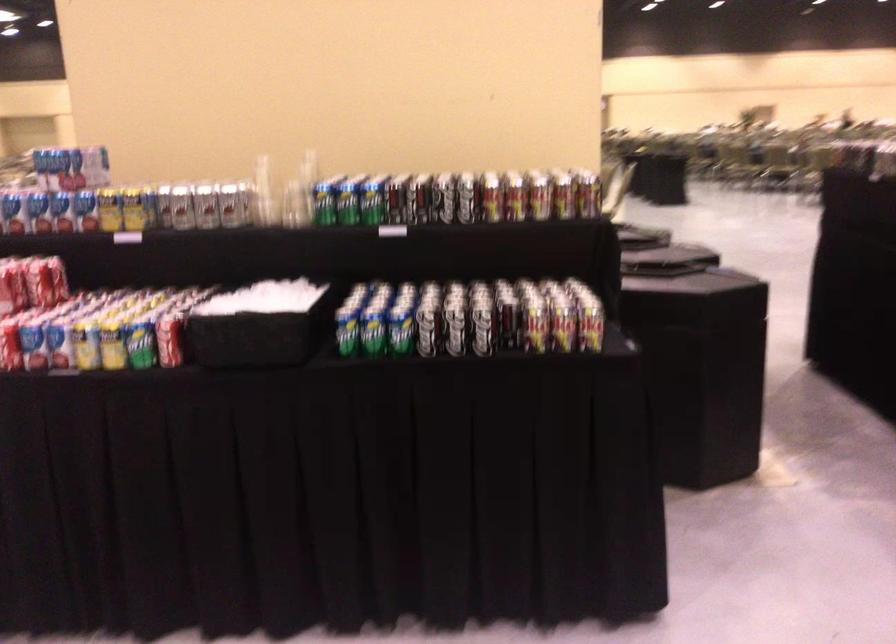
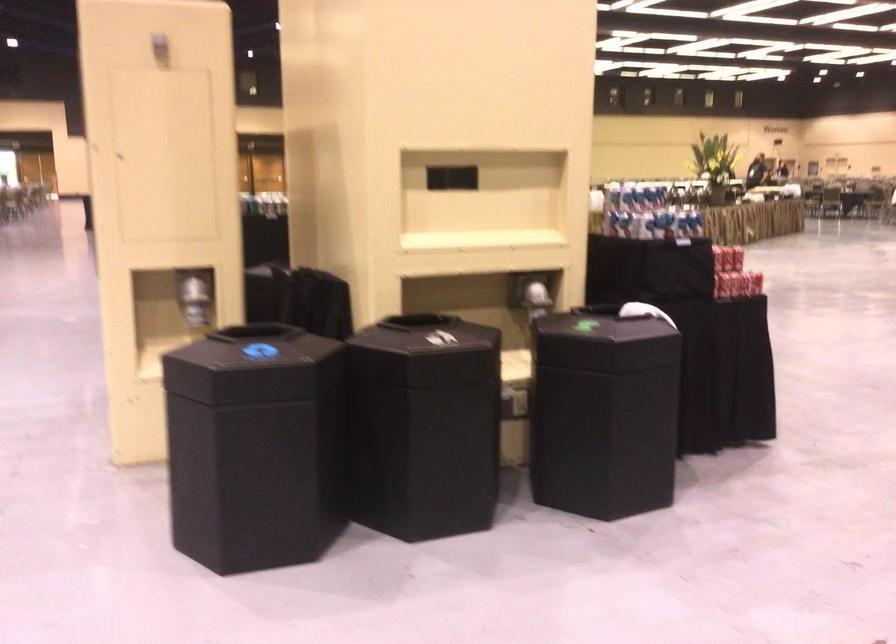
Question: I am providing you with two images of the same scene from different viewpoints. Which of the following objects are not visible in image2?

Choices:
 (A) green soda can
 (B) pencil holder
 (C) black bin lid
 (D) shiny dispenser lever

Answer: (A)